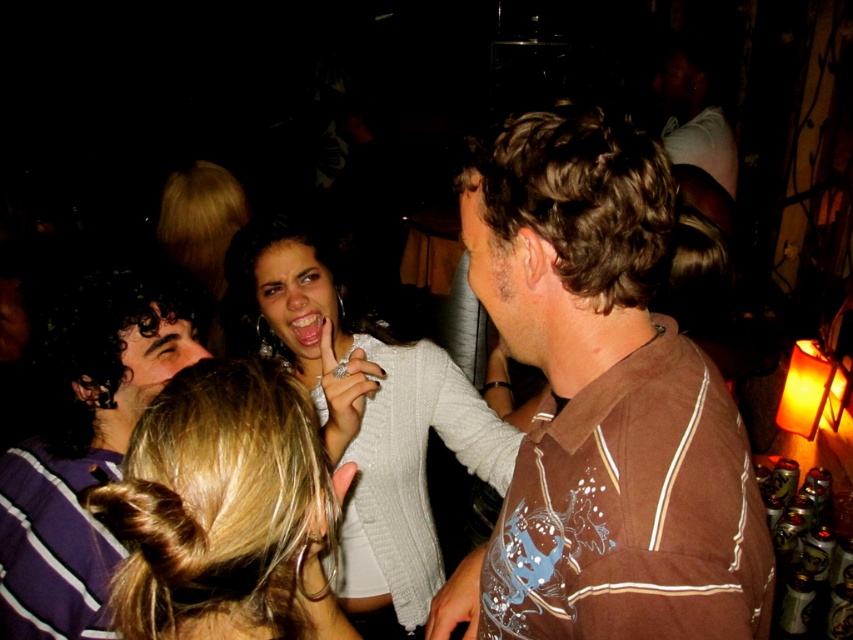
Between brown striped shirt at center and blonde hair at center, which one appears on the right side from the viewer's perspective?

brown striped shirt at center is more to the right.

Can you confirm if brown striped shirt at center is positioned to the left of blonde hair at center?

Incorrect, brown striped shirt at center is not on the left side of blonde hair at center.

Between point (627, 500) and point (242, 566), which one is positioned behind?

The point (627, 500) is more distant.

The image size is (853, 640). I want to click on brown striped shirt at center, so click(x=602, y=404).

Which of these two, blonde hair at center or purple striped shirt at left, stands taller?

With more height is purple striped shirt at left.

Is point (311, 509) farther from camera compared to point (120, 556)?

No, (311, 509) is closer to viewer.

This screenshot has width=853, height=640. I want to click on blonde hair at center, so click(x=225, y=509).

Does brown striped shirt at center appear over purple striped shirt at left?

Yes, brown striped shirt at center is above purple striped shirt at left.

Can you confirm if brown striped shirt at center is positioned to the left of purple striped shirt at left?

In fact, brown striped shirt at center is to the right of purple striped shirt at left.

Does point (569, 234) come behind point (59, 349)?

No, (569, 234) is closer to viewer.

Where is `brown striped shirt at center`? Image resolution: width=853 pixels, height=640 pixels. brown striped shirt at center is located at coordinates (602, 404).